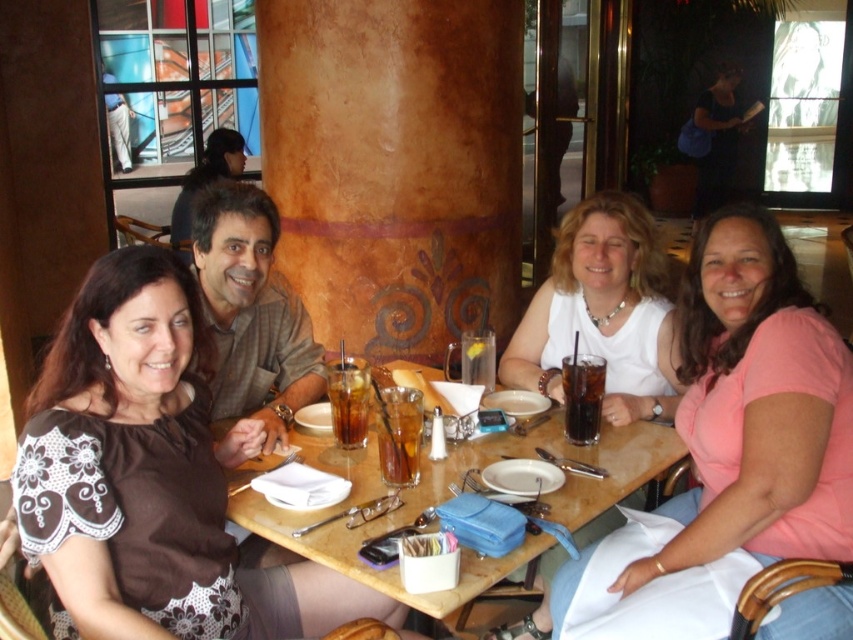
Which of these two, pink matte shirt at center or matte black shirt at upper left, stands taller?

With more height is pink matte shirt at center.

Consider the image. Who is positioned more to the right, pink matte shirt at center or matte black shirt at upper left?

pink matte shirt at center is more to the right.

Measure the distance between pink matte shirt at center and camera.

They are 1.59 meters apart.

The width and height of the screenshot is (853, 640). I want to click on pink matte shirt at center, so tap(756, 406).

Is pink matte shirt at center positioned at the back of dark brown glass at table center?

No, pink matte shirt at center is closer to the viewer.

Which is above, pink matte shirt at center or dark brown glass at table center?

Positioned higher is dark brown glass at table center.

Is point (679, 536) positioned in front of point (581, 435)?

Yes, point (679, 536) is closer to viewer.

Where is `pink matte shirt at center`? This screenshot has height=640, width=853. pink matte shirt at center is located at coordinates (756, 406).

From the picture: Is brown fabric shirt at upper left to the right of translucent glass cup at table center from the viewer's perspective?

Incorrect, brown fabric shirt at upper left is not on the right side of translucent glass cup at table center.

Does brown fabric shirt at upper left have a greater height compared to translucent glass cup at table center?

Yes.

Image resolution: width=853 pixels, height=640 pixels. In order to click on brown fabric shirt at upper left in this screenshot , I will do `click(151, 477)`.